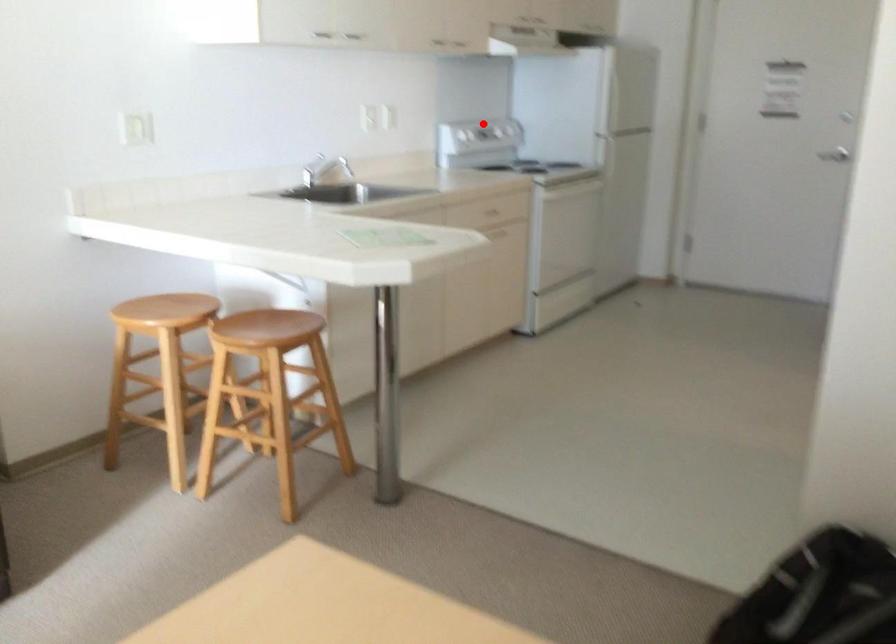
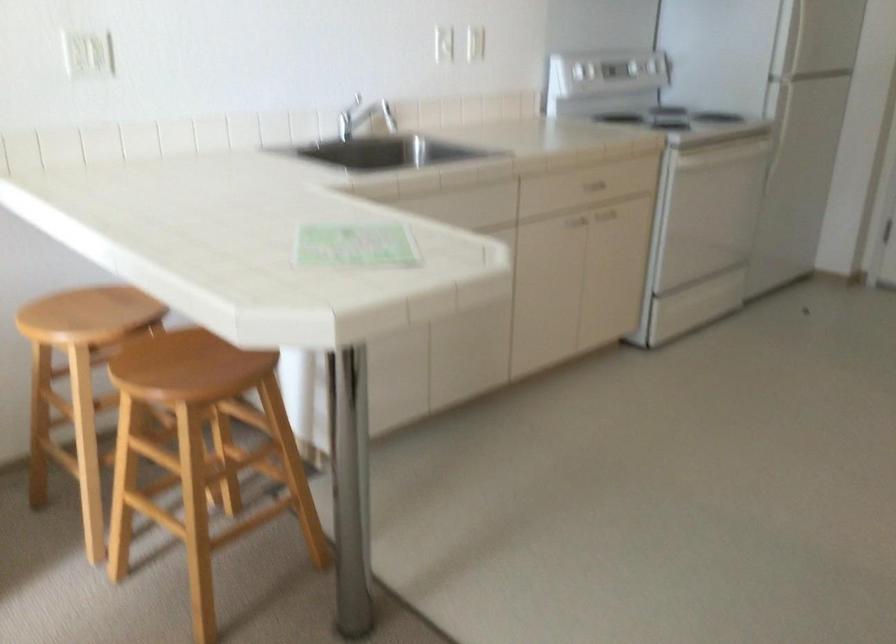
Question: I am providing you with two images of the same scene from different viewpoints. Given a red point in image1, look at the same physical point in image2. Is it:

Choices:
 (A) Closer to the viewpoint
 (B) Farther from the viewpoint

Answer: (A)